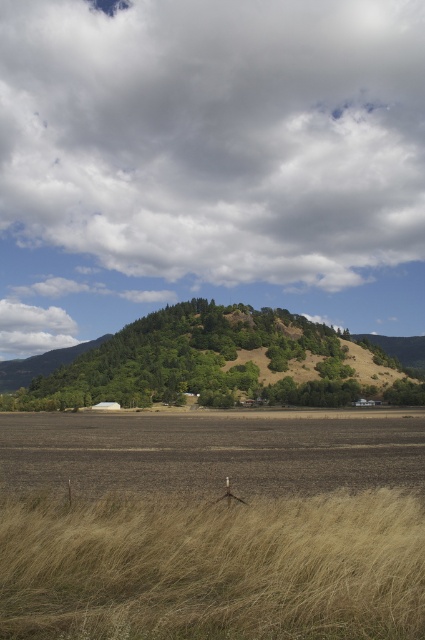
You are a farmer checking the field conditions. You notice the dry grass at lower left and the brown soil at center. Which area has a narrower width?

The dry grass at lower left has a narrower width than the brown soil at center.

You are a farmer planning to plant crops in the brown soil at center. You need to know if the cloudy sky at upper center will block sunlight for the crops. Can you determine this based on the scene?

The cloudy sky at upper center is bigger than the brown soil at center, so it may block more sunlight, potentially affecting crop growth.